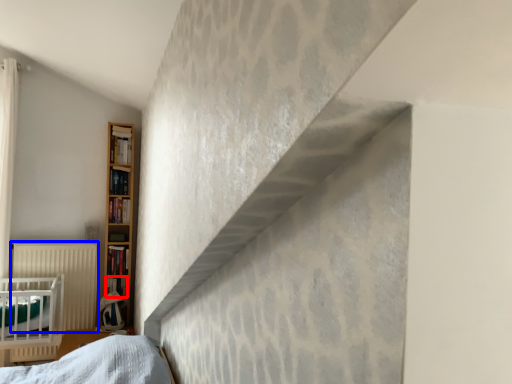
Question: Which of the following is the closest to the observer, book (highlighted by a red box) or radiator (highlighted by a blue box)?

Choices:
 (A) book
 (B) radiator

Answer: (B)